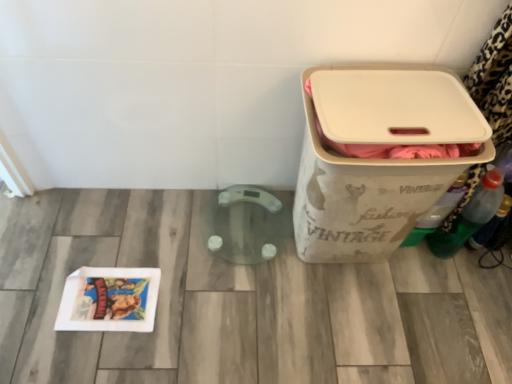
Identify the location of vacant space positioned to the left of beige fabric storage bin at right. This screenshot has width=512, height=384. (231, 261).